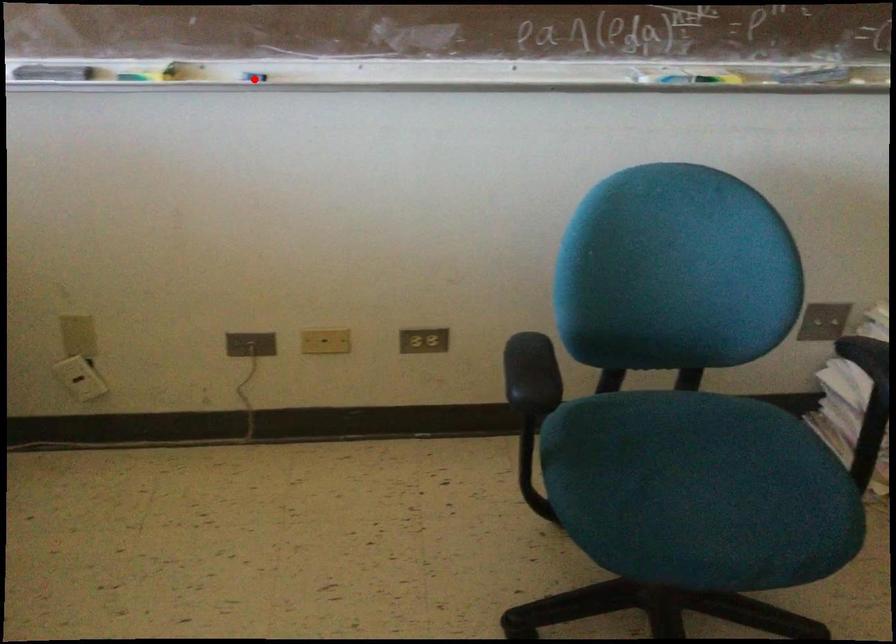
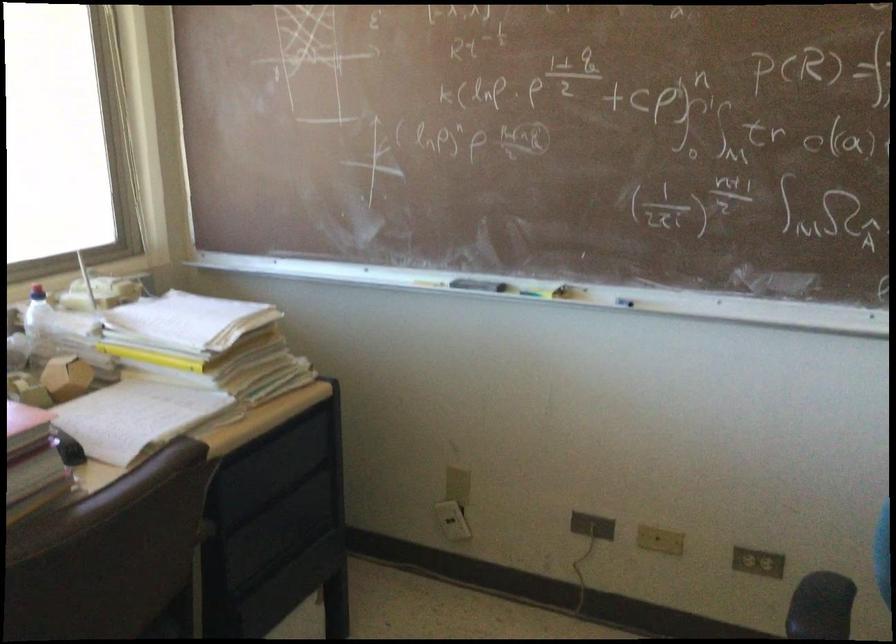
Locate, in the second image, the point that corresponds to the highlighted location in the first image.

(626, 304)